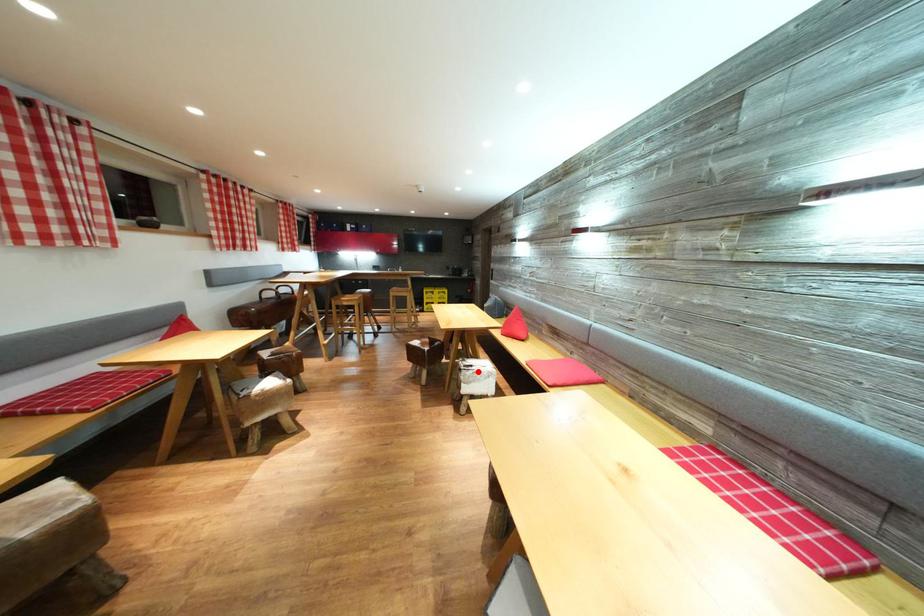
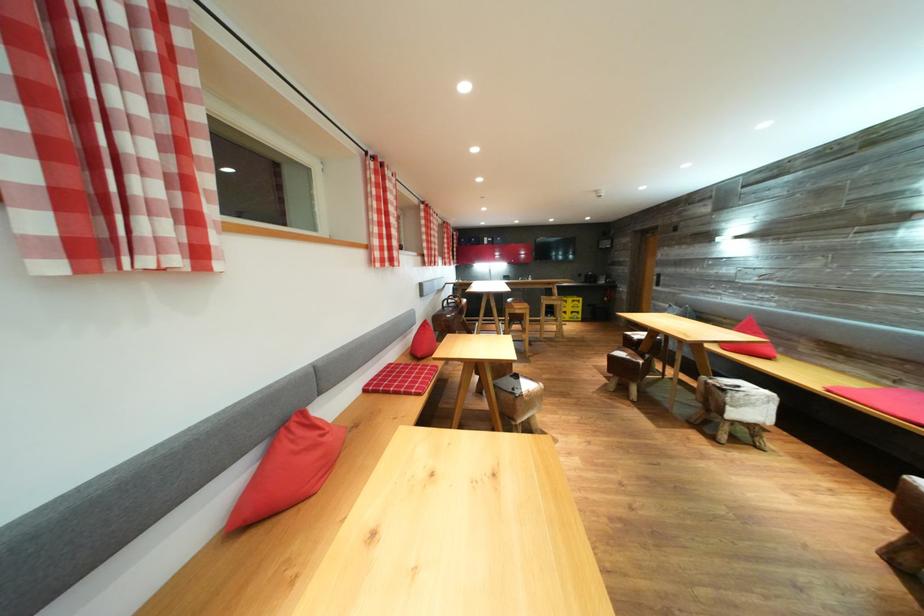
Find the pixel in the second image that matches the highlighted location in the first image.

(745, 392)